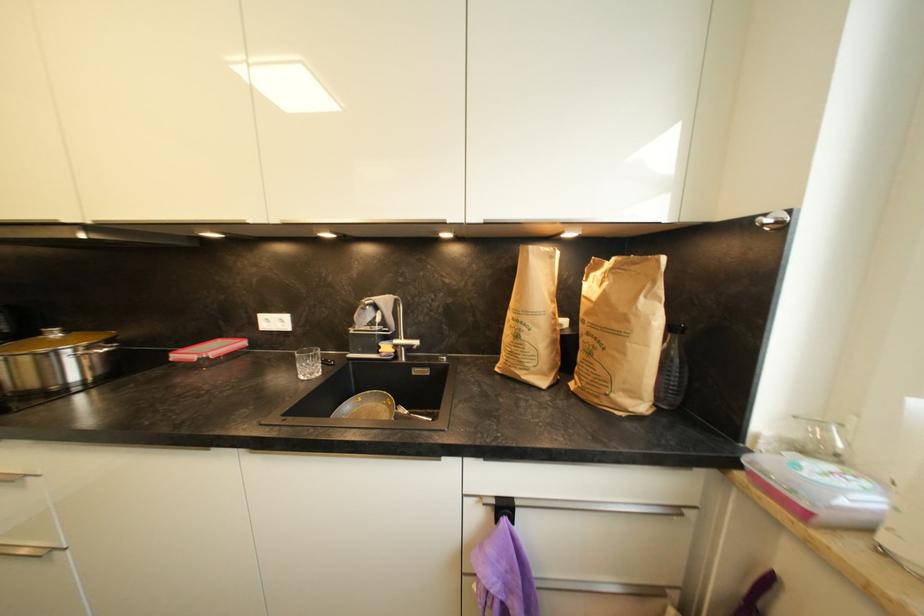
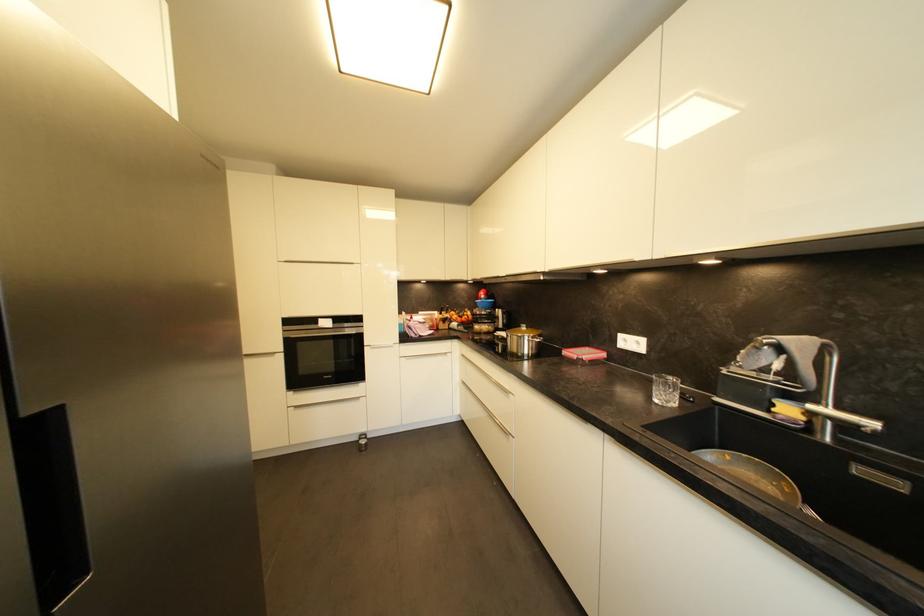
In the second image, find the point that corresponds to pixel 393 408 in the first image.

(787, 493)